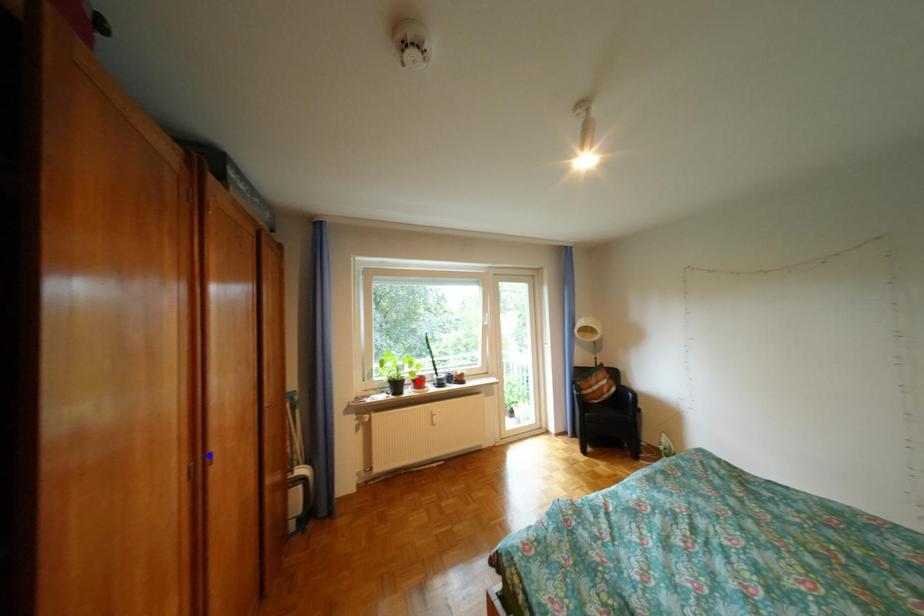
Question: Two points are marked on the image. Which point is closer to the camera?

Choices:
 (A) Blue point is closer.
 (B) Red point is closer.

Answer: (A)